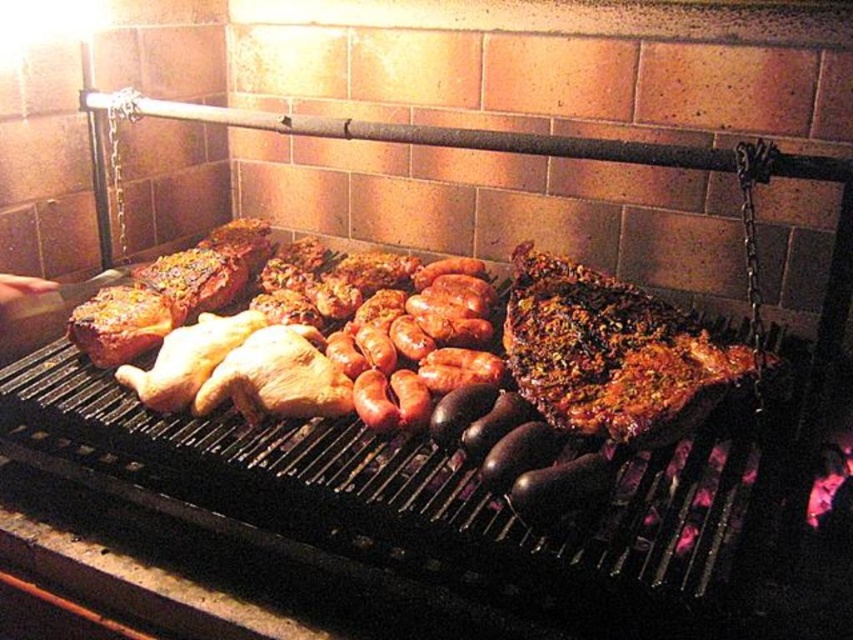
Is smooth brown sausages at center wider than golden brown skin at center?

Yes, smooth brown sausages at center is wider than golden brown skin at center.

Is the position of smooth brown sausages at center more distant than that of golden brown skin at center?

No, it is not.

Find the location of `smooth brown sausages at center`. smooth brown sausages at center is located at coordinates (418, 342).

Image resolution: width=853 pixels, height=640 pixels. I want to click on smooth brown sausages at center, so click(418, 342).

Does shiny brown steak at right appear under golden brown skin at center?

No, shiny brown steak at right is not below golden brown skin at center.

Is shiny brown steak at right closer to camera compared to golden brown skin at center?

Yes, shiny brown steak at right is in front of golden brown skin at center.

Is point (653, 419) positioned before point (328, 413)?

That is True.

This screenshot has height=640, width=853. I want to click on shiny brown steak at right, so click(613, 353).

Can you confirm if shiny brown steak at right is taller than smooth brown sausages at center?

Correct, shiny brown steak at right is much taller as smooth brown sausages at center.

Who is more distant from viewer, (631,320) or (335,340)?

The point (335,340) is more distant.

Image resolution: width=853 pixels, height=640 pixels. I want to click on shiny brown steak at right, so click(x=613, y=353).